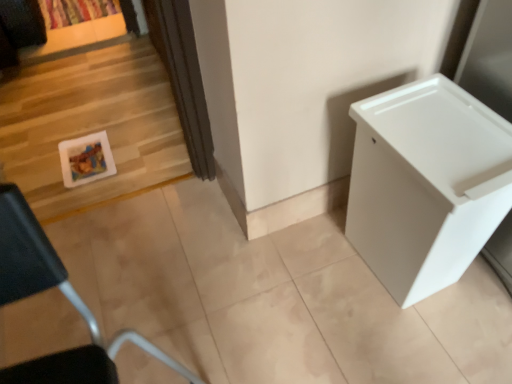
Locate an element on the screen. The image size is (512, 384). vacant space in front of multicolored fabric curtain at upper left is located at coordinates (75, 35).